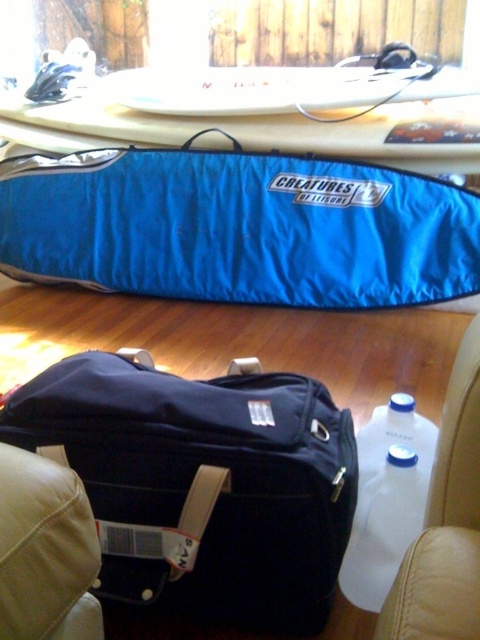
Is leather at lower right to the right of white plastic bottle at lower right from the viewer's perspective?

Yes, leather at lower right is to the right of white plastic bottle at lower right.

Is leather at lower right positioned before white plastic bottle at lower right?

Yes, leather at lower right is closer to the viewer.

The width and height of the screenshot is (480, 640). What do you see at coordinates (445, 522) in the screenshot? I see `leather at lower right` at bounding box center [445, 522].

Locate an element on the screen. leather at lower right is located at coordinates (445, 522).

Between blue fabric kayak at center and blue fabric surfboard at upper center, which one is positioned lower?

blue fabric kayak at center is lower down.

Does blue fabric kayak at center have a greater height compared to blue fabric surfboard at upper center?

No, blue fabric kayak at center is not taller than blue fabric surfboard at upper center.

Image resolution: width=480 pixels, height=640 pixels. Identify the location of blue fabric kayak at center. (x=238, y=227).

Between navy blue fabric suitcase at center and blue fabric surfboard at upper center, which one is positioned lower?

navy blue fabric suitcase at center is lower down.

From the picture: Is navy blue fabric suitcase at center to the right of blue fabric surfboard at upper center from the viewer's perspective?

In fact, navy blue fabric suitcase at center is to the left of blue fabric surfboard at upper center.

What do you see at coordinates (202, 484) in the screenshot?
I see `navy blue fabric suitcase at center` at bounding box center [202, 484].

The height and width of the screenshot is (640, 480). Find the location of `navy blue fabric suitcase at center`. navy blue fabric suitcase at center is located at coordinates pos(202,484).